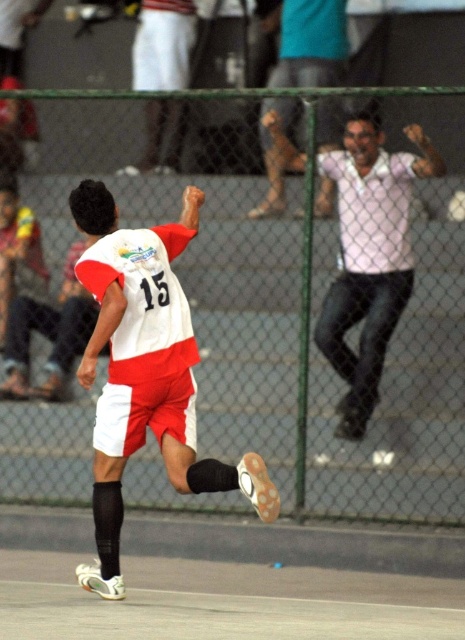
In the scene shown: You are a photographer trying to capture a clear shot of both the white shirt at upper right and the white shirt at upper center in the soccer match image. Which shirt should you focus on first to ensure it appears in the foreground?

The white shirt at upper right is positioned under the white shirt at upper center, so focusing on the white shirt at upper center first will ensure it stays in the foreground while the white shirt at upper right is slightly behind.

You are a photographer trying to capture a clear shot of the white matte soccer jersey at center without the white shirt at upper right blocking it. Can you adjust your position to achieve this?

Yes, since the white matte soccer jersey at center is in front of the white shirt at upper right, adjusting your position to focus on the foreground will allow you to capture the jersey without the shirt blocking it.

You are a photographer standing behind the fence. You want to take a photo of the soccer player wearing the white matte soccer jersey at center and the person in the white shirt at upper center. Which of the two will appear larger in your photo?

The white matte soccer jersey at center will appear larger in the photo because it is bigger than the white shirt at upper center.